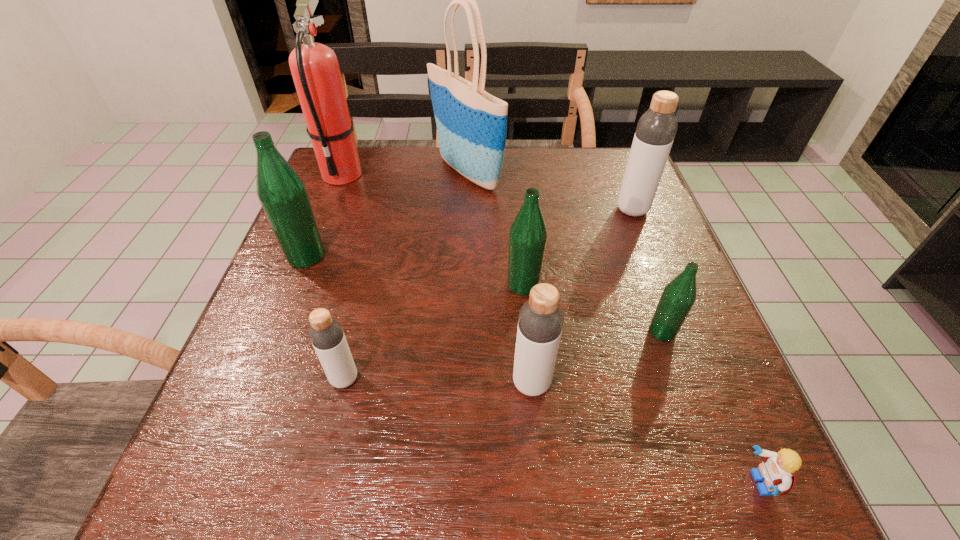
Find the location of `tote bag`. tote bag is located at coordinates (471, 124).

This screenshot has width=960, height=540. Find the location of `fire extinguisher`. fire extinguisher is located at coordinates (314, 66).

The height and width of the screenshot is (540, 960). In order to click on the biggest gray bottle in this screenshot , I will do `click(656, 129)`.

At what (x,y) coordinates should I click in order to perform the action: click on the third farthest object. Please return your answer as a coordinate pair (x, y). This screenshot has height=540, width=960. Looking at the image, I should click on (656, 129).

Identify the location of the biggest green bottle. (283, 195).

This screenshot has width=960, height=540. Find the location of `the farthest green bottle`. the farthest green bottle is located at coordinates (283, 195).

Find the location of a particular element. the second biggest green bottle is located at coordinates (528, 233).

Identify the location of the third farthest bottle. (528, 233).

Find the location of a particular element. the second gray bottle from left to right is located at coordinates (540, 322).

This screenshot has height=540, width=960. Identify the location of the third object from left to right. (326, 334).